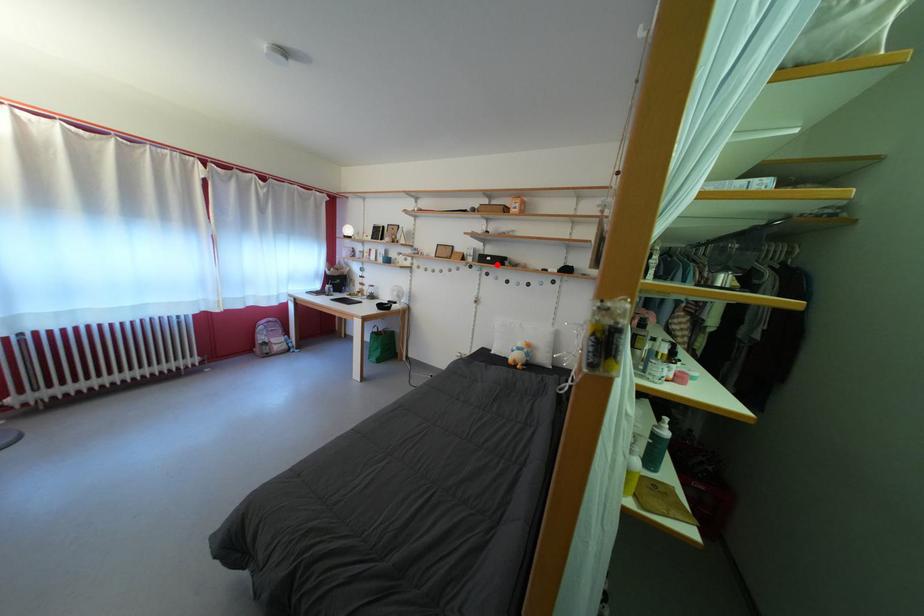
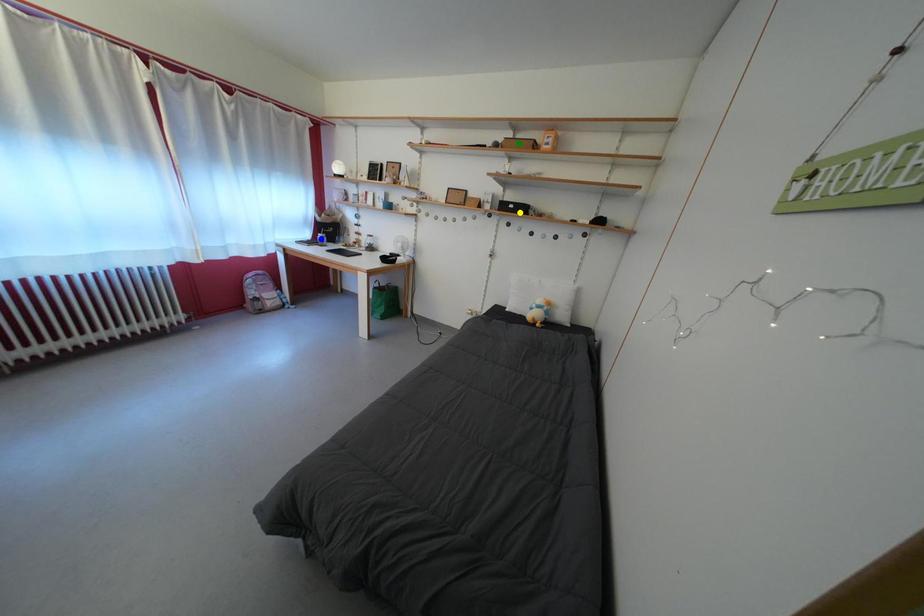
Question: I am providing you with two images of the same scene from different viewpoints. A red point is marked on the first image. You are given multiple points on the second image. Can you choose the point in image 2 that corresponds to the point in image 1?

Choices:
 (A) green point
 (B) yellow point
 (C) blue point

Answer: (B)